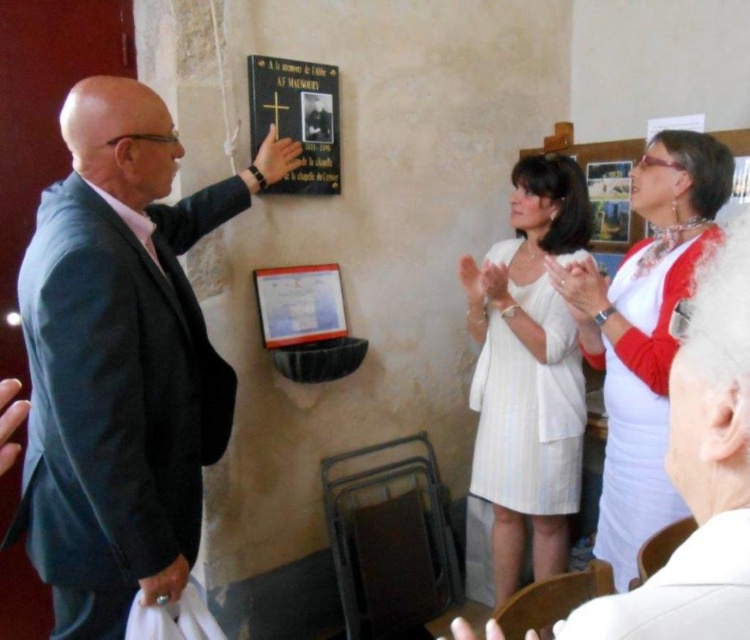
You are standing in the church and need to locate the white textured dress at center. According to the coordinates provided, where exactly is it positioned?

The white textured dress at center is positioned at coordinates point (528,372).

Where is the dark blue suit at left located in the image?

The dark blue suit at left is located at point (122,358) in the image.

You are a photographer at this event and need to capture a photo that includes both the white satin dress at upper right and the black matte plaque at upper center. What is the minimum distance you need to move backward to ensure both are in frame?

The white satin dress at upper right is 1.12 meters from the black matte plaque at upper center. To include both in the photo, you need to move back at least 1.12 meters to ensure the entire distance between them is captured.